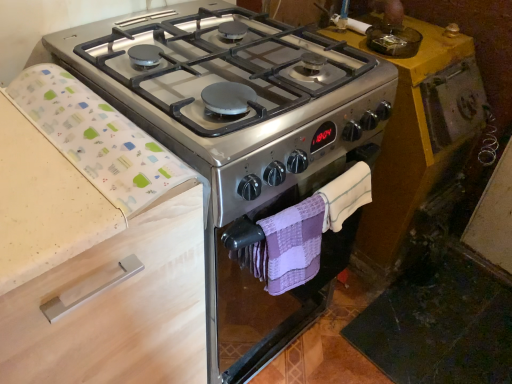
Question: Is beige wood drawer at left a part of satin silver gas stove at center?

Choices:
 (A) yes
 (B) no

Answer: (B)

Question: Can you confirm if satin silver gas stove at center is shorter than beige wood drawer at left?

Choices:
 (A) no
 (B) yes

Answer: (B)

Question: Considering the relative sizes of satin silver gas stove at center and beige wood drawer at left in the image provided, is satin silver gas stove at center wider than beige wood drawer at left?

Choices:
 (A) yes
 (B) no

Answer: (A)

Question: Is satin silver gas stove at center next to beige wood drawer at left and touching it?

Choices:
 (A) yes
 (B) no

Answer: (B)

Question: Is satin silver gas stove at center positioned before beige wood drawer at left?

Choices:
 (A) no
 (B) yes

Answer: (A)

Question: Is point (352, 211) closer or farther from the camera than point (69, 158)?

Choices:
 (A) closer
 (B) farther

Answer: (B)

Question: From a real-world perspective, relative to white fabric at left, is purple woven hand towel at center, the 2th hand towel viewed from the left, vertically above or below?

Choices:
 (A) above
 (B) below

Answer: (B)

Question: Considering the positions of purple woven hand towel at center, the 2th hand towel viewed from the left, and white fabric at left in the image, is purple woven hand towel at center, the 2th hand towel viewed from the left, bigger or smaller than white fabric at left?

Choices:
 (A) small
 (B) big

Answer: (A)

Question: Visually, is purple woven hand towel at center, which is the first hand towel in right-to-left order, positioned to the left or to the right of white fabric at left?

Choices:
 (A) left
 (B) right

Answer: (B)

Question: Is satin silver gas stove at center bigger or smaller than beige wood drawer at left?

Choices:
 (A) small
 (B) big

Answer: (A)

Question: Considering the positions of satin silver gas stove at center and beige wood drawer at left in the image, is satin silver gas stove at center wider or thinner than beige wood drawer at left?

Choices:
 (A) wide
 (B) thin

Answer: (A)

Question: Relative to beige wood drawer at left, is satin silver gas stove at center in front or behind?

Choices:
 (A) front
 (B) behind

Answer: (B)

Question: From a real-world perspective, relative to beige wood drawer at left, is satin silver gas stove at center vertically above or below?

Choices:
 (A) above
 (B) below

Answer: (A)

Question: In the image, is white fabric at left positioned in front of or behind beige wood drawer at left?

Choices:
 (A) behind
 (B) front

Answer: (A)

Question: From a real-world perspective, relative to beige wood drawer at left, is white fabric at left vertically above or below?

Choices:
 (A) above
 (B) below

Answer: (A)